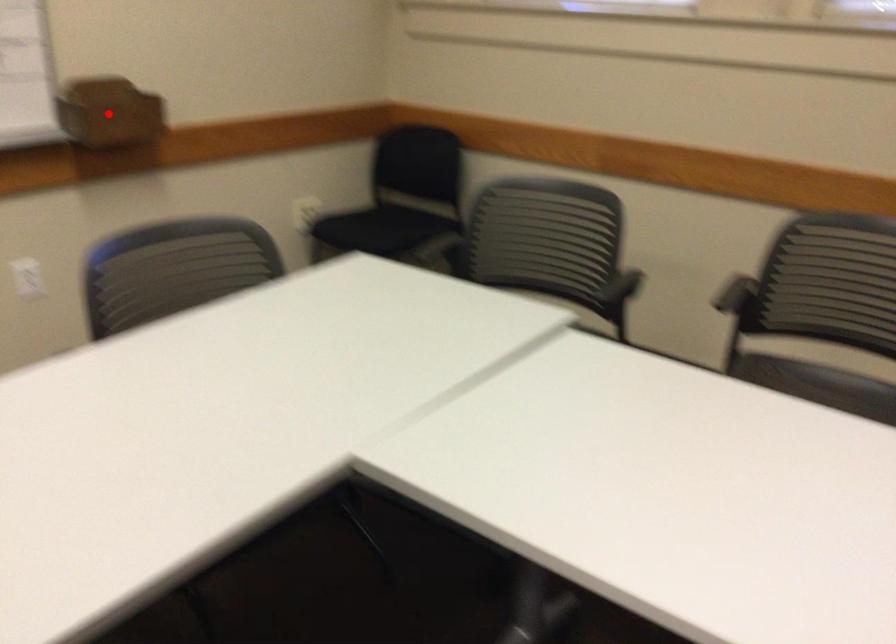
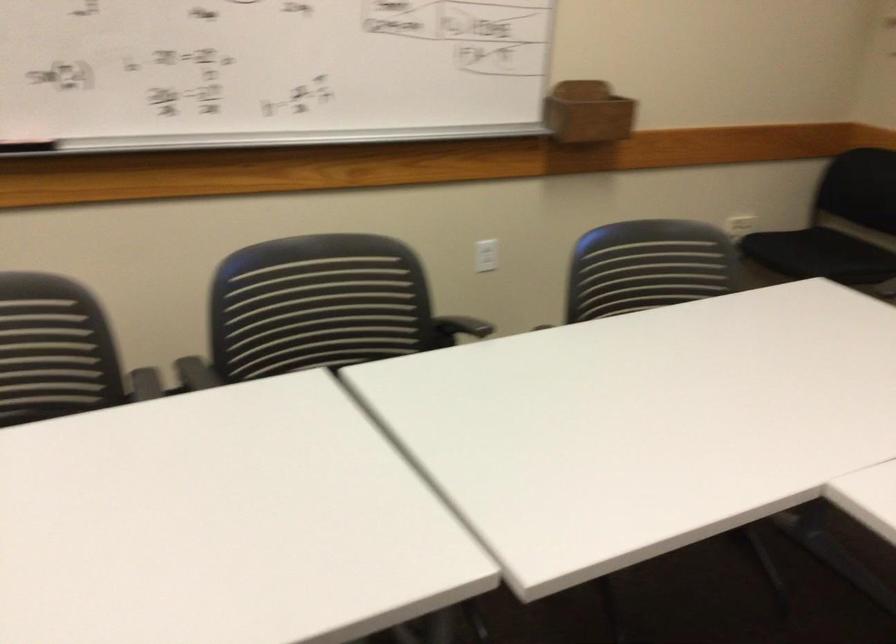
Where in the second image is the point corresponding to the highlighted location from the first image?

(588, 111)